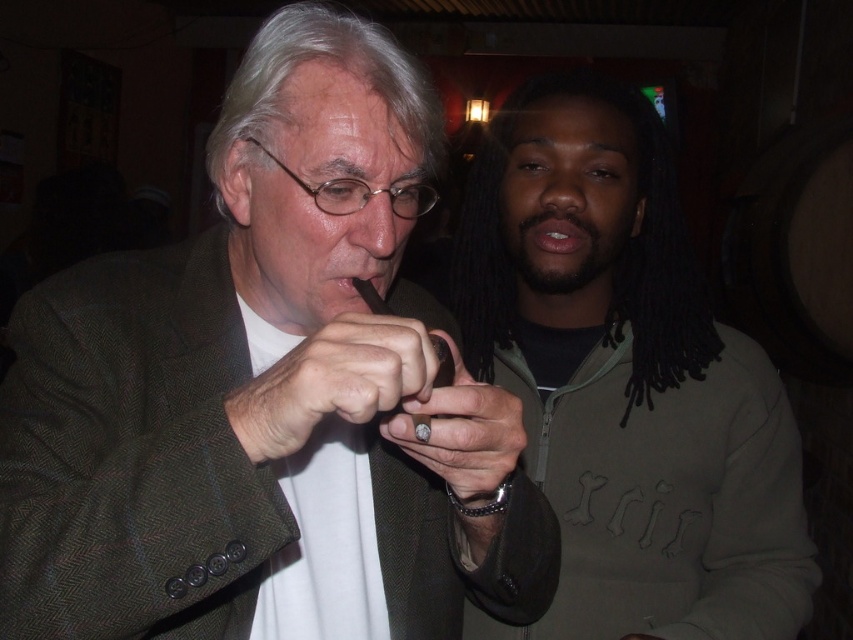
You are standing in front of the two people in the image. Which of the two points, point (576, 236) or point (368, 301), is closer to you?

Point (368, 301) is closer to you because it is less further to the camera than point (576, 236).

Based on the scene description, which object is larger in size between the matte black ring at center and the black matte mouth at center?

The matte black ring at center is bigger than the black matte mouth at center, so the matte black ring is larger in size.

Based on the description provided, where exactly is the matte black ring at center located in the image?

The matte black ring at center is located at the 2D coordinates point (332,381) in the image.